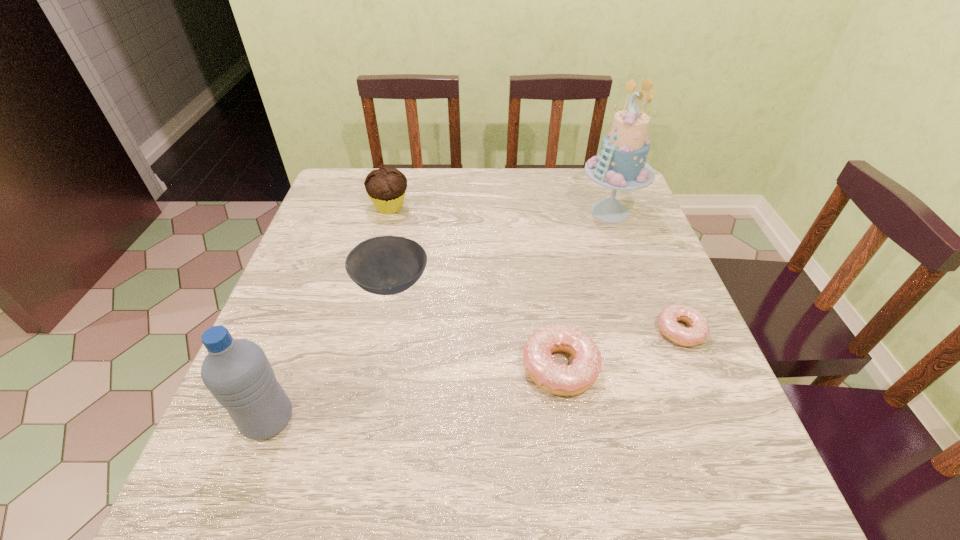
You are a GUI agent. You are given a task and a screenshot of the screen. Output one action in this format:
    pyautogui.click(x=<x>, y=<y>)
    Task: Click on the fourth object from left to right
    This screenshot has width=960, height=540.
    Given the screenshot: What is the action you would take?
    pyautogui.click(x=574, y=379)

Find the location of a particular element. This screenshot has width=960, height=540. the taller doughnut is located at coordinates (574, 379).

Identify the location of the shorter doughnut. This screenshot has width=960, height=540. (668, 324).

Identify the location of the shortest object. This screenshot has width=960, height=540. (668, 324).

Identify the location of bowl. This screenshot has width=960, height=540. (386, 265).

Locate an element on the screen. This screenshot has height=540, width=960. the tallest object is located at coordinates (621, 165).

Where is `muffin`? muffin is located at coordinates (386, 186).

Locate an element on the screen. The image size is (960, 540). the leftmost object is located at coordinates (237, 372).

Find the location of a particular element. Image resolution: width=960 pixels, height=540 pixels. water bottle is located at coordinates (237, 372).

What are the coordinates of `vacant space situated 0.210m on the left of the left doughnut` in the screenshot? It's located at (415, 367).